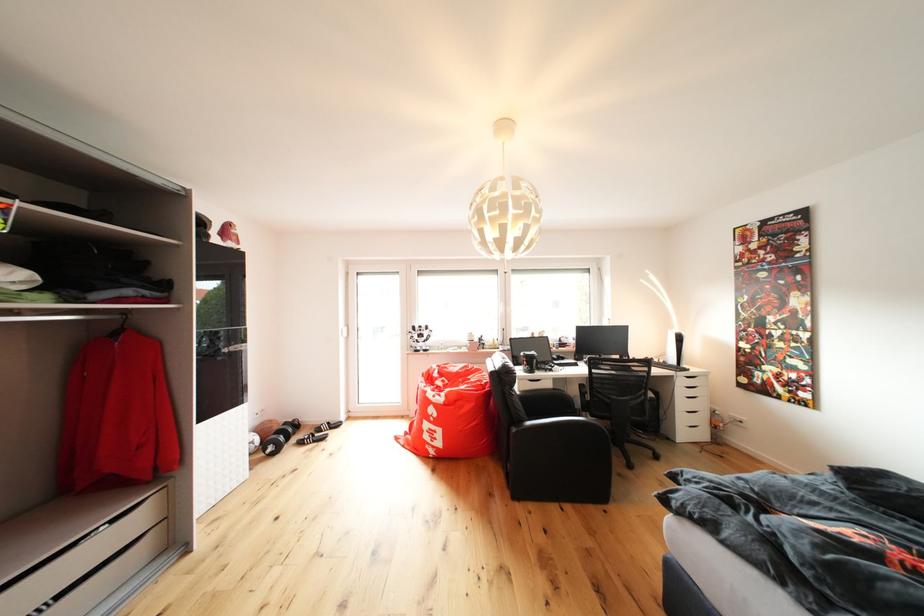
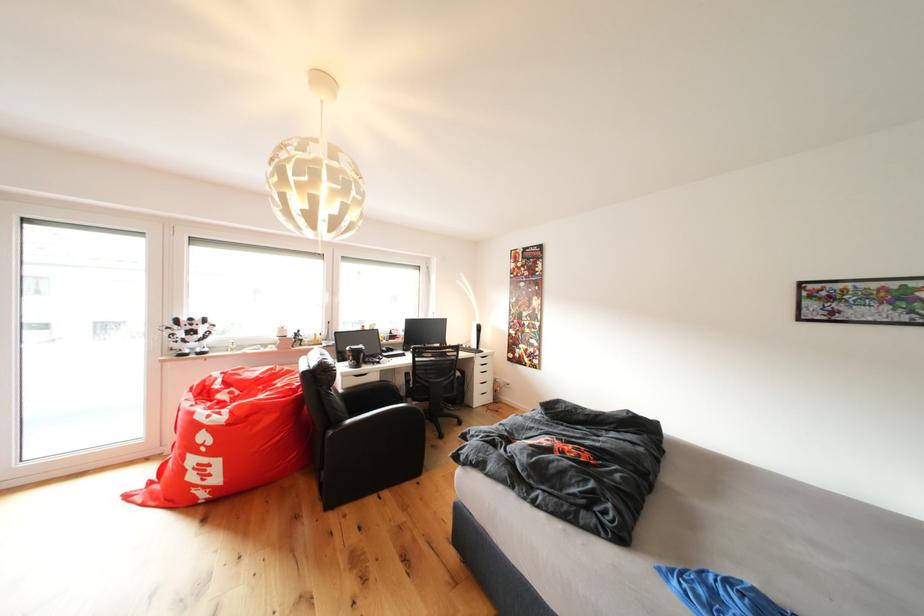
Where in the second image is the point corresponding to (x=535, y=361) from the first image?

(361, 355)